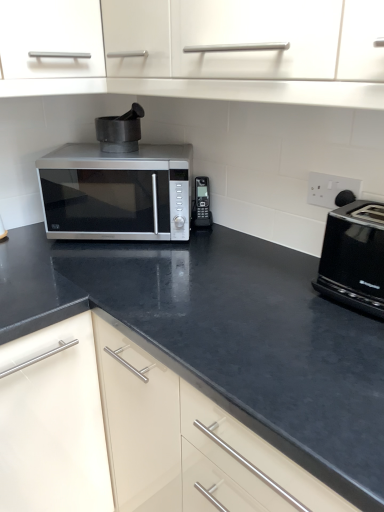
Describe the element at coordinates (120, 131) in the screenshot. The height and width of the screenshot is (512, 384). I see `black matte mortar at center, which is the 1th appliance from left to right` at that location.

In order to face satin silver microwave at center, should I rotate leftwards or rightwards?

You should look left and rotate roughly 9.245 degrees.

Locate an element on the screen. satin silver microwave at center is located at coordinates (117, 193).

Locate an element on the screen. Image resolution: width=384 pixels, height=512 pixels. black plastic phone at center, acting as the 1th appliance starting from the right is located at coordinates (202, 204).

Describe the element at coordinates (354, 257) in the screenshot. The width and height of the screenshot is (384, 512). I see `black plastic toaster at right` at that location.

Identify the location of white plastic electric outlet at upper right. (329, 188).

The height and width of the screenshot is (512, 384). What are the coordinates of `black matte mortar at center, the 1th appliance from the top` in the screenshot? It's located at (120, 131).

Is satin silver microwave at center taller than black plastic phone at center, acting as the 1th appliance starting from the right?

Correct, satin silver microwave at center is much taller as black plastic phone at center, acting as the 1th appliance starting from the right.

Considering the sizes of satin silver microwave at center and black plastic phone at center, acting as the 1th appliance starting from the right, in the image, is satin silver microwave at center bigger or smaller than black plastic phone at center, acting as the 1th appliance starting from the right,?

In the image, satin silver microwave at center appears to be larger than black plastic phone at center, acting as the 1th appliance starting from the right.

Is satin silver microwave at center placed right next to black plastic phone at center, the 2th appliance from the top?

No.

Is satin silver microwave at center oriented towards black plastic phone at center, which appears as the second appliance when viewed from the left?

No, satin silver microwave at center is not facing towards black plastic phone at center, which appears as the second appliance when viewed from the left.

Considering the points (200, 211) and (133, 111), which point is in front, point (200, 211) or point (133, 111)?

The point (133, 111) is closer to the camera.

Who is shorter, black plastic phone at center, which appears as the second appliance when viewed from the left, or black matte mortar at center, which is the second appliance in right-to-left order?

With less height is black matte mortar at center, which is the second appliance in right-to-left order.

Considering the sizes of objects black plastic phone at center, the first appliance when ordered from bottom to top, and black matte mortar at center, which is the second appliance in right-to-left order, in the image provided, who is wider, black plastic phone at center, the first appliance when ordered from bottom to top, or black matte mortar at center, which is the second appliance in right-to-left order,?

Wider between the two is black matte mortar at center, which is the second appliance in right-to-left order.

Is black plastic phone at center, which appears as the second appliance when viewed from the left, positioned with its back to black matte mortar at center, the 1th appliance from the top?

No, black plastic phone at center, which appears as the second appliance when viewed from the left, is not facing the opposite direction of black matte mortar at center, the 1th appliance from the top.

Looking at the image, does white plastic electric outlet at upper right seem bigger or smaller compared to satin silver microwave at center?

white plastic electric outlet at upper right is smaller than satin silver microwave at center.

Does white plastic electric outlet at upper right appear on the right side of satin silver microwave at center?

Indeed, white plastic electric outlet at upper right is positioned on the right side of satin silver microwave at center.

From a real-world perspective, who is located lower, white plastic electric outlet at upper right or satin silver microwave at center?

In real-world perspective, satin silver microwave at center is lower.

Does point (328, 181) appear closer or farther from the camera than point (97, 177)?

Point (328, 181) is positioned closer to the camera compared to point (97, 177).

Does black matte mortar at center, the second appliance from the bottom, have a lesser width compared to white plastic electric outlet at upper right?

Incorrect, the width of black matte mortar at center, the second appliance from the bottom, is not less than that of white plastic electric outlet at upper right.

How many degrees apart are the facing directions of black matte mortar at center, the second appliance from the bottom, and white plastic electric outlet at upper right?

They differ by 48 degrees in their facing directions.

Is the position of black matte mortar at center, the second appliance from the bottom, less distant than that of white plastic electric outlet at upper right?

That is False.

From a real-world perspective, is black matte mortar at center, the second appliance from the bottom, positioned under white plastic electric outlet at upper right based on gravity?

No, from a real-world perspective, black matte mortar at center, the second appliance from the bottom, is not under white plastic electric outlet at upper right.

Who is taller, white plastic electric outlet at upper right or black plastic toaster at right?

Standing taller between the two is black plastic toaster at right.

Which is in front, point (331, 200) or point (356, 205)?

The point (356, 205) is closer to the camera.

Is white plastic electric outlet at upper right positioned with its back to black plastic toaster at right?

No, white plastic electric outlet at upper right is not facing away from black plastic toaster at right.

Is white plastic electric outlet at upper right behind black plastic toaster at right?

Yes, it is.

From a real-world perspective, which is physically below, white plastic electric outlet at upper right or black matte mortar at center, which is the second appliance in right-to-left order?

white plastic electric outlet at upper right is physically lower.

Does white plastic electric outlet at upper right have a greater height compared to black matte mortar at center, which is the second appliance in right-to-left order?

In fact, white plastic electric outlet at upper right may be shorter than black matte mortar at center, which is the second appliance in right-to-left order.

Looking at the image, does white plastic electric outlet at upper right seem bigger or smaller compared to black matte mortar at center, the 1th appliance from the top?

white plastic electric outlet at upper right is smaller than black matte mortar at center, the 1th appliance from the top.

Is white plastic electric outlet at upper right oriented away from black matte mortar at center, the 1th appliance from the top?

No, white plastic electric outlet at upper right's orientation is not away from black matte mortar at center, the 1th appliance from the top.

Between black matte mortar at center, which is the 1th appliance from left to right, and satin silver microwave at center, which one appears on the left side from the viewer's perspective?

Positioned to the left is satin silver microwave at center.

Is point (130, 128) farther from camera compared to point (159, 227)?

Yes, it is.

Is black matte mortar at center, the 1th appliance from the top, turned away from satin silver microwave at center?

No, satin silver microwave at center is not at the back of black matte mortar at center, the 1th appliance from the top.

Locate an element on the screen. The image size is (384, 512). microwave oven above the black plastic phone at center, the 2th appliance from the top (from the image's perspective) is located at coordinates (117, 193).

This screenshot has height=512, width=384. Identify the location of appliance to the left of black plastic phone at center, the first appliance when ordered from bottom to top. (120, 131).

Considering their positions, is black plastic phone at center, acting as the 1th appliance starting from the right, positioned closer to black matte mortar at center, the second appliance from the bottom, than satin silver microwave at center?

The object closer to black matte mortar at center, the second appliance from the bottom, is satin silver microwave at center.

Looking at the image, which one is located further to satin silver microwave at center, white plastic electric outlet at upper right or black matte mortar at center, which is the second appliance in right-to-left order?

Among the two, white plastic electric outlet at upper right is located further to satin silver microwave at center.

From the image, which object appears to be farther from black plastic toaster at right, white plastic electric outlet at upper right or black plastic phone at center, the first appliance when ordered from bottom to top?

Among the two, black plastic phone at center, the first appliance when ordered from bottom to top, is located further to black plastic toaster at right.

From the image, which object appears to be farther from black matte mortar at center, the 1th appliance from the top, satin silver microwave at center or black plastic toaster at right?

Among the two, black plastic toaster at right is located further to black matte mortar at center, the 1th appliance from the top.

From the image, which object appears to be farther from black plastic phone at center, the 2th appliance from the top, black plastic toaster at right or black matte mortar at center, which is the 1th appliance from left to right?

black plastic toaster at right.

Looking at the image, which one is located further to satin silver microwave at center, black matte mortar at center, the 1th appliance from the top, or black plastic toaster at right?

black plastic toaster at right.

Based on their spatial positions, is black plastic toaster at right or satin silver microwave at center further from black matte mortar at center, the 1th appliance from the top?

black plastic toaster at right lies further to black matte mortar at center, the 1th appliance from the top, than the other object.

Looking at the image, which one is located further to black plastic phone at center, the first appliance when ordered from bottom to top, white plastic electric outlet at upper right or satin silver microwave at center?

white plastic electric outlet at upper right lies further to black plastic phone at center, the first appliance when ordered from bottom to top, than the other object.

Locate an element on the screen. electric outlet between satin silver microwave at center and black plastic toaster at right from left to right is located at coordinates (329, 188).

Find the location of a particular element. The image size is (384, 512). appliance between black matte mortar at center, which is the 1th appliance from left to right, and white plastic electric outlet at upper right from left to right is located at coordinates (202, 204).

In order to click on electric outlet between black plastic toaster at right and black plastic phone at center, which appears as the second appliance when viewed from the left, in the front-back direction in this screenshot , I will do `click(329, 188)`.

Identify the location of electric outlet between black matte mortar at center, the second appliance from the bottom, and black plastic toaster at right, in the horizontal direction. Image resolution: width=384 pixels, height=512 pixels. (329, 188).